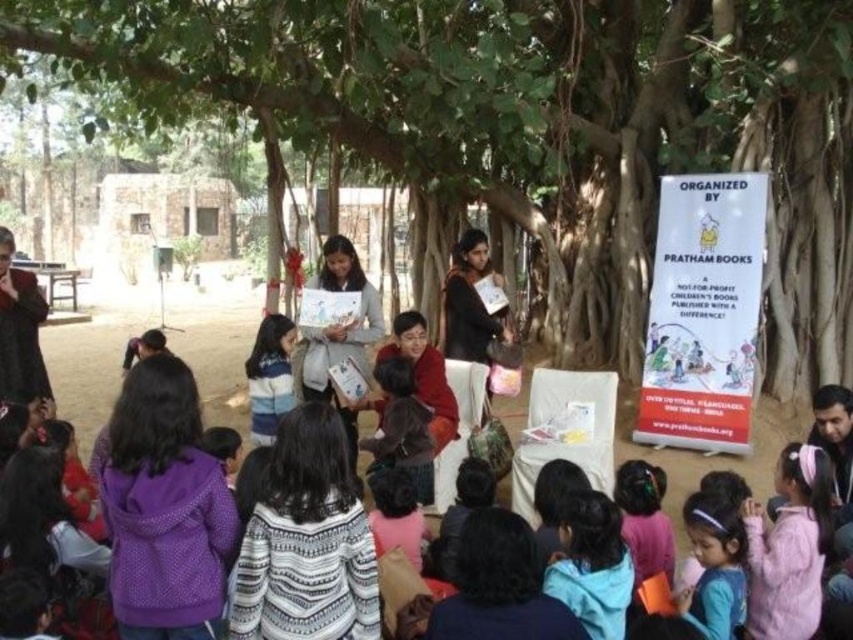
Which is behind, point (769, 563) or point (245, 371)?

Point (245, 371)

Is pink fuzzy jacket at lower right closer to the viewer compared to striped sweater at center?

That is True.

Who is more distant from viewer, [790,637] or [285,364]?

The point [285,364] is behind.

Locate an element on the screen. The width and height of the screenshot is (853, 640). pink fuzzy jacket at lower right is located at coordinates (788, 547).

Is purple fleece jacket at lower left closer to camera compared to pink fuzzy jacket at lower right?

Yes, purple fleece jacket at lower left is in front of pink fuzzy jacket at lower right.

Is purple fleece jacket at lower left smaller than pink fuzzy jacket at lower right?

No.

Locate an element on the screen. purple fleece jacket at lower left is located at coordinates (165, 508).

Between green leafy tree at center and purple fleece jacket at lower left, which one is positioned higher?

green leafy tree at center is higher up.

Who is positioned more to the right, green leafy tree at center or purple fleece jacket at lower left?

From the viewer's perspective, green leafy tree at center appears more on the right side.

At what (x,y) coordinates should I click in order to perform the action: click on green leafy tree at center. Please return your answer as a coordinate pair (x, y). Looking at the image, I should click on tap(534, 129).